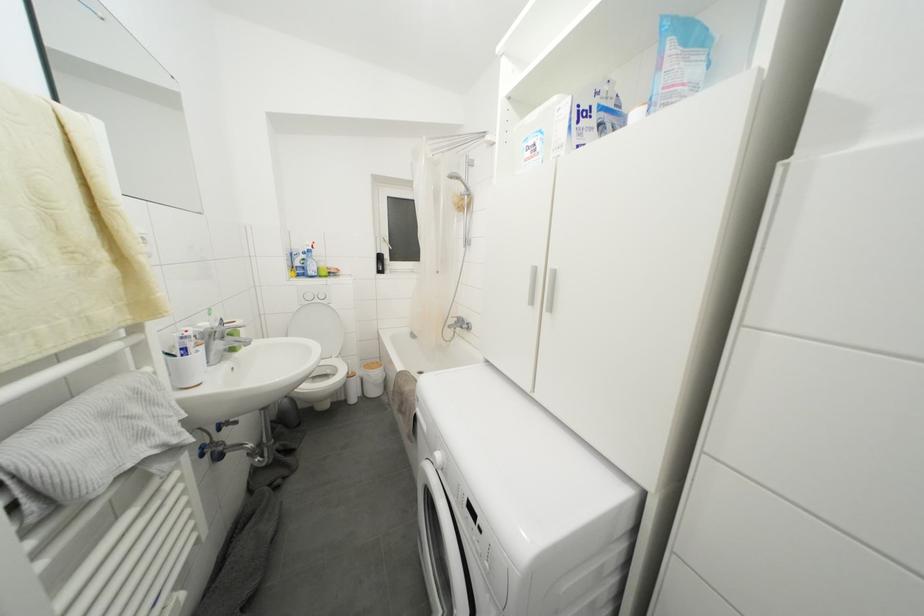
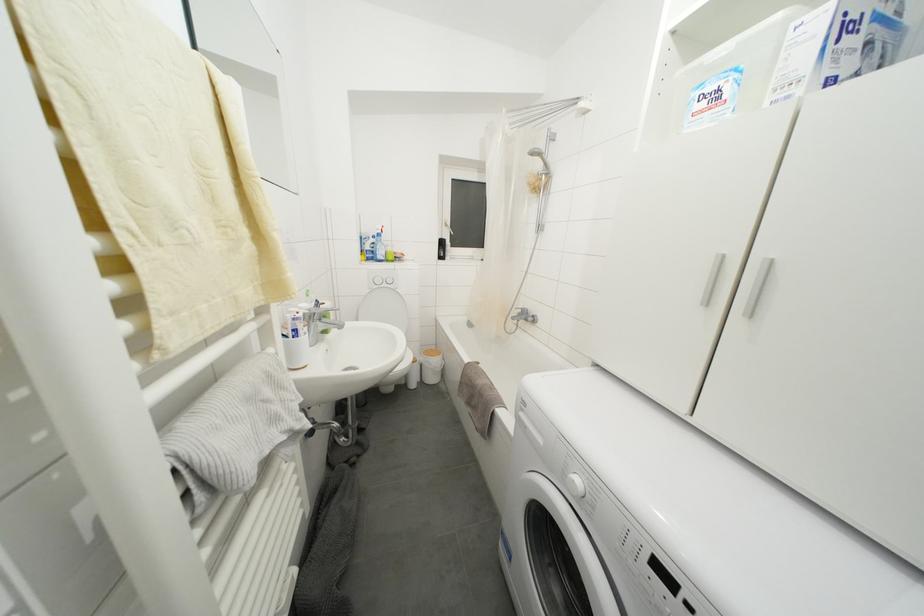
What movement of the cameraman would produce the second image?

The cameraman moved toward left, forward.